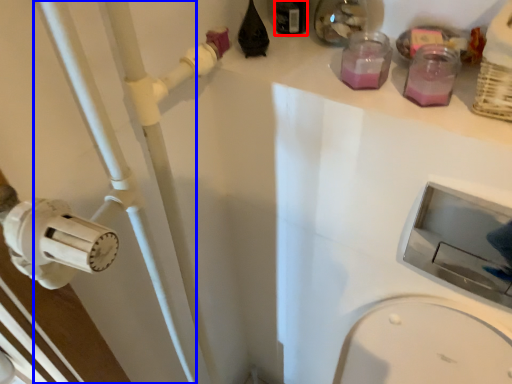
Question: Among these objects, which one is nearest to the camera, bottle (highlighted by a red box) or pipe (highlighted by a blue box)?

Choices:
 (A) bottle
 (B) pipe

Answer: (B)